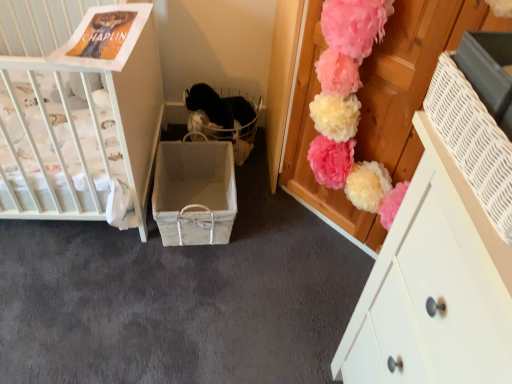
What are the coordinates of `white wicker crib at left` in the screenshot? It's located at (84, 131).

At what (x,y) coordinates should I click in order to perform the action: click on black wicker basket at center. Please return your answer as a coordinate pair (x, y). Looking at the image, I should click on (223, 118).

Considering the positions of points (243, 102) and (507, 325), is point (243, 102) farther from camera compared to point (507, 325)?

That is True.

You are a GUI agent. You are given a task and a screenshot of the screen. Output one action in this format:
    pyautogui.click(x=<x>, y=<y>)
    Task: Click on the baby carriage that is behind the white painted wood cabinet at upper right
    The height and width of the screenshot is (384, 512).
    Given the screenshot: What is the action you would take?
    pyautogui.click(x=223, y=118)

Is white painted wood cabinet at upper right inside black wicker basket at center?

No, white painted wood cabinet at upper right is not a part of black wicker basket at center.

From the image's perspective, does black wicker basket at center appear lower than white painted wood cabinet at upper right?

Incorrect, from the image's perspective, black wicker basket at center is higher than white painted wood cabinet at upper right.

Is white painted wood cabinet at upper right looking in the opposite direction of white wicker basket at center, which ranks as the 2th storage box in front-to-back order?

No, white painted wood cabinet at upper right's orientation is not away from white wicker basket at center, which ranks as the 2th storage box in front-to-back order.

Considering the relative sizes of white painted wood cabinet at upper right and white wicker basket at center, which ranks as the 2th storage box in front-to-back order, in the image provided, is white painted wood cabinet at upper right smaller than white wicker basket at center, which ranks as the 2th storage box in front-to-back order,?

No, white painted wood cabinet at upper right is not smaller than white wicker basket at center, which ranks as the 2th storage box in front-to-back order.

Does white painted wood cabinet at upper right come behind white wicker basket at center, which is the first storage box from back to front?

No, it is in front of white wicker basket at center, which is the first storage box from back to front.

Is white painted wood cabinet at upper right touching white wicker basket at center, which is the first storage box from back to front?

No, white painted wood cabinet at upper right is not making contact with white wicker basket at center, which is the first storage box from back to front.

In the scene shown: Is black wicker basket at center oriented towards white wicker basket at center, marked as the 2th storage box in a right-to-left arrangement?

Yes, black wicker basket at center faces towards white wicker basket at center, marked as the 2th storage box in a right-to-left arrangement.

Who is more distant, black wicker basket at center or white wicker basket at center, which is the first storage box from back to front?

black wicker basket at center is further from the camera.

From the image's perspective, relative to white wicker basket at center, which ranks as the 2th storage box in front-to-back order, is black wicker basket at center above or below?

Clearly, from the image's perspective, black wicker basket at center is above white wicker basket at center, which ranks as the 2th storage box in front-to-back order.

Is white painted wood cabinet at upper right positioned with its back to white wicker basket at right, marked as the 1th storage box in a right-to-left arrangement?

white painted wood cabinet at upper right does not have its back to white wicker basket at right, marked as the 1th storage box in a right-to-left arrangement.

Is white painted wood cabinet at upper right in front of or behind white wicker basket at right, which appears as the first storage box when viewed from the front, in the image?

Visually, white painted wood cabinet at upper right is located behind white wicker basket at right, which appears as the first storage box when viewed from the front.

Which object is positioned more to the right, white painted wood cabinet at upper right or white wicker basket at right, placed as the second storage box when sorted from left to right?

Positioned to the right is white painted wood cabinet at upper right.

Is white painted wood cabinet at upper right touching white wicker basket at right, which appears as the first storage box when viewed from the front?

No, white painted wood cabinet at upper right is not touching white wicker basket at right, which appears as the first storage box when viewed from the front.

Considering the relative positions of white painted wood cabinet at upper right and white wicker crib at left in the image provided, is white painted wood cabinet at upper right behind white wicker crib at left?

No, white painted wood cabinet at upper right is closer to the camera.

Image resolution: width=512 pixels, height=384 pixels. In order to click on cabinetry located above the white wicker crib at left (from a real-world perspective) in this screenshot , I will do `click(434, 287)`.

How many degrees apart are the facing directions of white painted wood cabinet at upper right and white wicker crib at left?

They differ by 89 degrees in their facing directions.

Between white painted wood cabinet at upper right and white wicker crib at left, which one appears on the right side from the viewer's perspective?

white painted wood cabinet at upper right.

From a real-world perspective, which object rests below the other?

white wicker basket at center, marked as the 2th storage box in a right-to-left arrangement, is physically lower.

Is the surface of white wicker basket at center, marked as the 2th storage box in a right-to-left arrangement, in direct contact with white painted wood cabinet at upper right?

No, white wicker basket at center, marked as the 2th storage box in a right-to-left arrangement, is not beside white painted wood cabinet at upper right.

Is point (185, 162) farther from camera compared to point (433, 296)?

That is True.

From the image's perspective, would you say white wicker basket at center, marked as the 2th storage box in a right-to-left arrangement, is positioned over white painted wood cabinet at upper right?

Correct, white wicker basket at center, marked as the 2th storage box in a right-to-left arrangement, appears higher than white painted wood cabinet at upper right in the image.

Which of these two, white wicker basket at right, placed as the second storage box when sorted from left to right, or black wicker basket at center, stands taller?

black wicker basket at center is taller.

Can you confirm if white wicker basket at right, which is the 2th storage box from back to front, is bigger than black wicker basket at center?

Actually, white wicker basket at right, which is the 2th storage box from back to front, might be smaller than black wicker basket at center.

Relative to black wicker basket at center, is white wicker basket at right, marked as the 1th storage box in a right-to-left arrangement, in front or behind?

white wicker basket at right, marked as the 1th storage box in a right-to-left arrangement, is positioned closer to the viewer than black wicker basket at center.

Which is behind, point (483, 175) or point (227, 127)?

The point (227, 127) is more distant.

Locate an element on the screen. cabinetry on the right of black wicker basket at center is located at coordinates (434, 287).

Locate an element on the screen. This screenshot has height=384, width=512. storage box behind the white painted wood cabinet at upper right is located at coordinates (194, 193).

Looking at the image, which one is located closer to white painted wood cabinet at upper right, white wicker crib at left or black wicker basket at center?

white wicker crib at left lies closer to white painted wood cabinet at upper right than the other object.

When comparing their distances from white wicker basket at center, the first storage box in the left-to-right sequence, does black wicker basket at center or white painted wood cabinet at upper right seem further?

The object further to white wicker basket at center, the first storage box in the left-to-right sequence, is white painted wood cabinet at upper right.

Considering their positions, is white wicker crib at left positioned closer to white wicker basket at right, which appears as the first storage box when viewed from the front, than black wicker basket at center?

Based on the image, white wicker crib at left appears to be nearer to white wicker basket at right, which appears as the first storage box when viewed from the front.

Looking at the image, which one is located closer to white wicker basket at center, the first storage box in the left-to-right sequence, black wicker basket at center or white wicker crib at left?

Among the two, black wicker basket at center is located nearer to white wicker basket at center, the first storage box in the left-to-right sequence.

Which object lies nearer to the anchor point white wicker basket at center, the first storage box in the left-to-right sequence, white wicker crib at left or white wicker basket at right, marked as the 1th storage box in a right-to-left arrangement?

white wicker crib at left is closer to white wicker basket at center, the first storage box in the left-to-right sequence.

Estimate the real-world distances between objects in this image. Which object is closer to black wicker basket at center, white painted wood cabinet at upper right or white wicker basket at center, the first storage box in the left-to-right sequence?

Answer: Among the two, white wicker basket at center, the first storage box in the left-to-right sequence, is located nearer to black wicker basket at center.

Estimate the real-world distances between objects in this image. Which object is further from white wicker basket at right, placed as the second storage box when sorted from left to right, white wicker crib at left or white painted wood cabinet at upper right?

Based on the image, white wicker crib at left appears to be further to white wicker basket at right, placed as the second storage box when sorted from left to right.

Estimate the real-world distances between objects in this image. Which object is closer to white painted wood cabinet at upper right, white wicker basket at center, marked as the 2th storage box in a right-to-left arrangement, or white wicker basket at right, which is the 2th storage box from back to front?

white wicker basket at right, which is the 2th storage box from back to front, is positioned closer to the anchor white painted wood cabinet at upper right.

What are the coordinates of `baby carriage between white wicker crib at left and white painted wood cabinet at upper right in the horizontal direction` in the screenshot? It's located at (223, 118).

Locate an element on the screen. Image resolution: width=512 pixels, height=384 pixels. cabinetry between white wicker basket at right, which appears as the first storage box when viewed from the front, and white wicker basket at center, the first storage box in the left-to-right sequence, from front to back is located at coordinates point(434,287).

The image size is (512, 384). I want to click on storage box between white wicker crib at left and white wicker basket at right, marked as the 1th storage box in a right-to-left arrangement, in the horizontal direction, so click(194, 193).

Find the location of a particular element. Image resolution: width=512 pixels, height=384 pixels. cabinetry located between white wicker basket at right, placed as the second storage box when sorted from left to right, and black wicker basket at center in the depth direction is located at coordinates (434, 287).